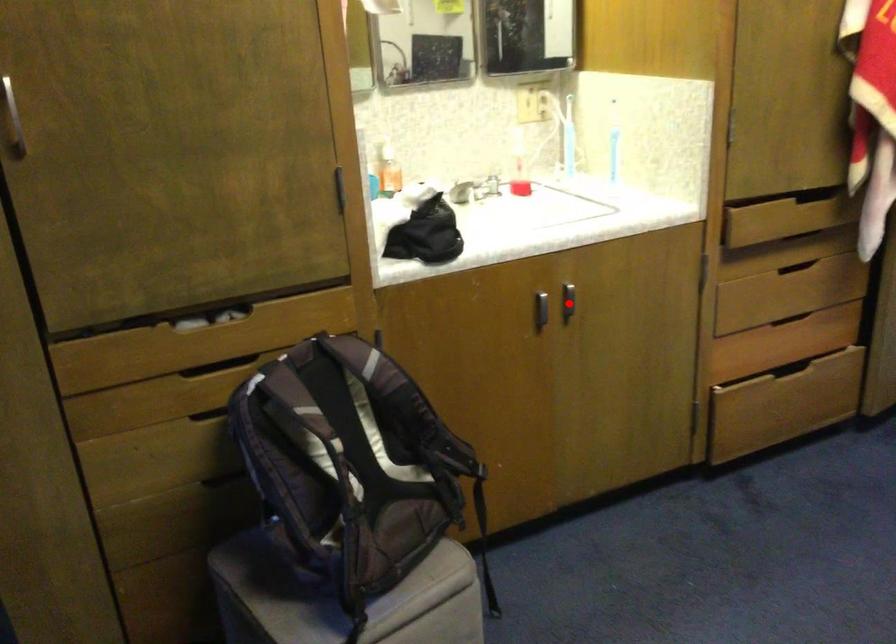
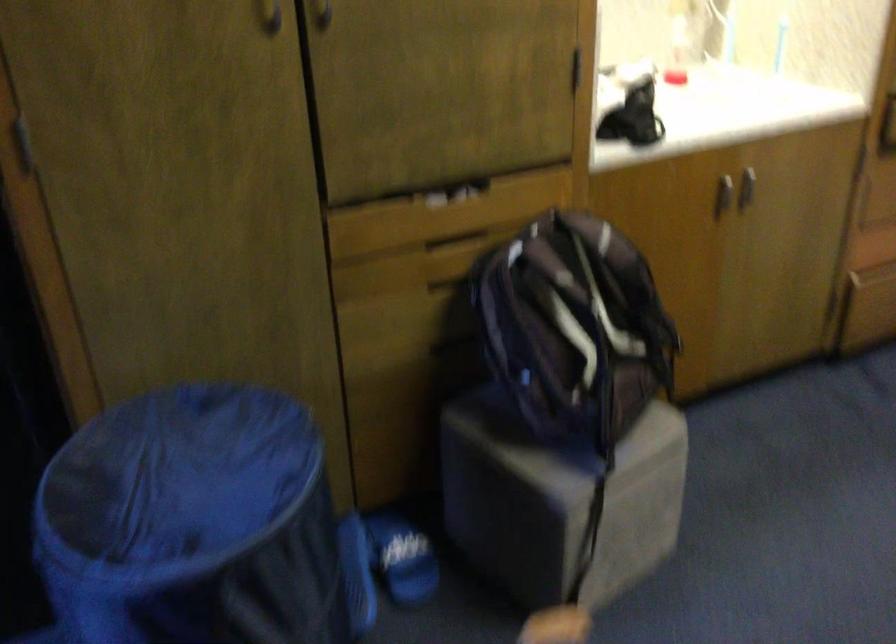
Where in the second image is the point corresponding to the highlighted location from the first image?

(746, 187)